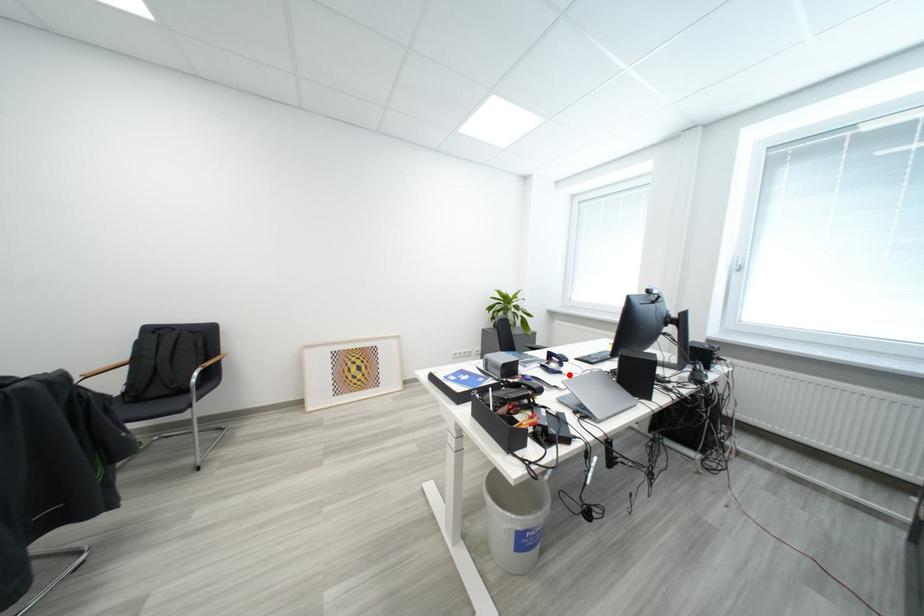
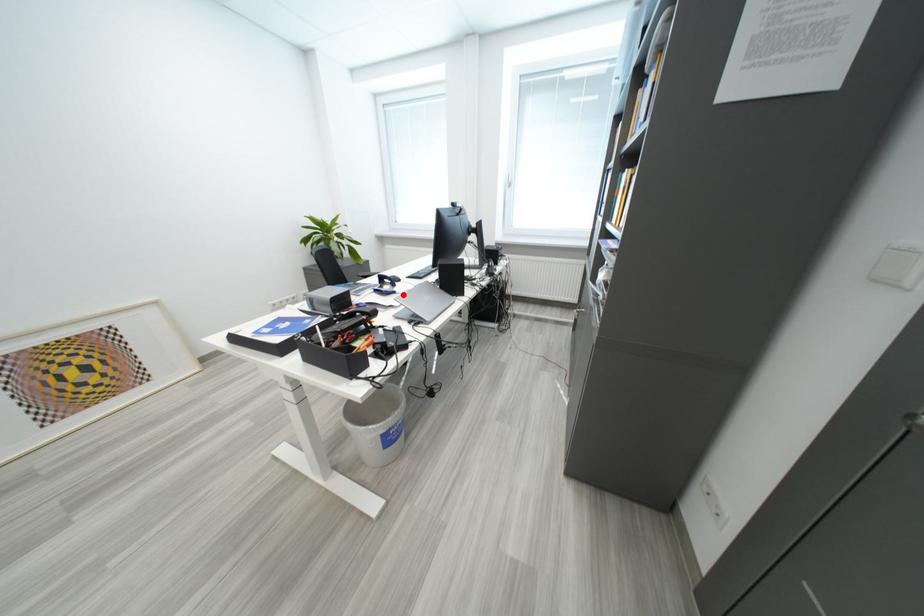
I am providing you with two images of the same scene from different viewpoints. A red point is marked on the first image and another point is marked on the second image. Is the red point in image1 aligned with the point shown in image2?

Yes